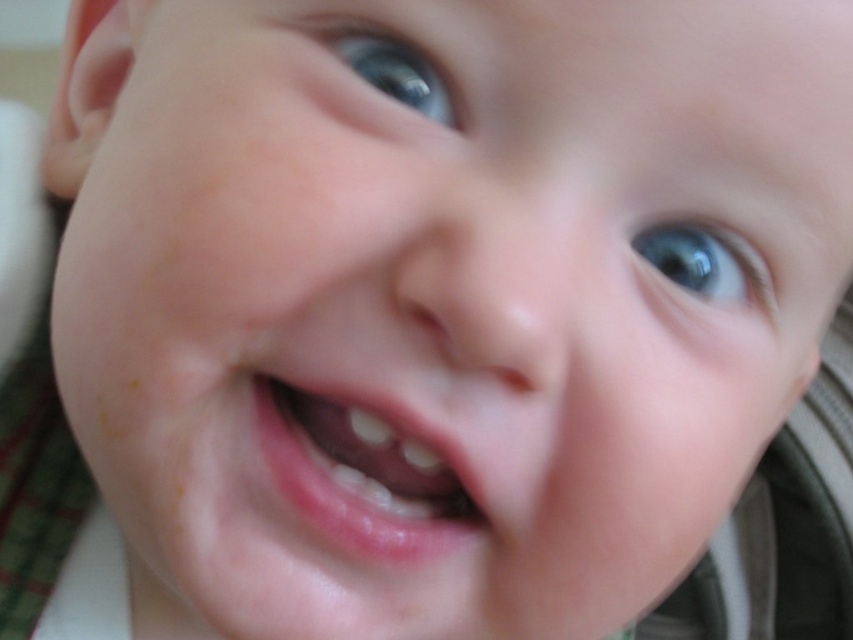
Can you confirm if pink glossy lips at center is positioned to the left of blue glossy eye at upper center?

Indeed, pink glossy lips at center is positioned on the left side of blue glossy eye at upper center.

Which is in front, point (280, 419) or point (412, 76)?

Point (412, 76)

Where is `pink glossy lips at center`? Image resolution: width=853 pixels, height=640 pixels. pink glossy lips at center is located at coordinates (352, 486).

Where is `pink glossy lips at center`? pink glossy lips at center is located at coordinates (352, 486).

This screenshot has width=853, height=640. Describe the element at coordinates (706, 262) in the screenshot. I see `blue glossy eye at upper right` at that location.

Can you confirm if blue glossy eye at upper right is smaller than blue glossy eye at upper center?

Incorrect, blue glossy eye at upper right is not smaller in size than blue glossy eye at upper center.

Is point (746, 248) positioned behind point (397, 99)?

That is True.

This screenshot has height=640, width=853. What are the coordinates of `blue glossy eye at upper right` in the screenshot? It's located at (706, 262).

This screenshot has width=853, height=640. What do you see at coordinates (352, 486) in the screenshot? I see `pink glossy lips at center` at bounding box center [352, 486].

Does pink glossy lips at center have a smaller size compared to blue glossy eye at upper right?

No.

Describe the element at coordinates (352, 486) in the screenshot. This screenshot has height=640, width=853. I see `pink glossy lips at center` at that location.

Find the location of a particular element. Image resolution: width=853 pixels, height=640 pixels. pink glossy lips at center is located at coordinates (352, 486).